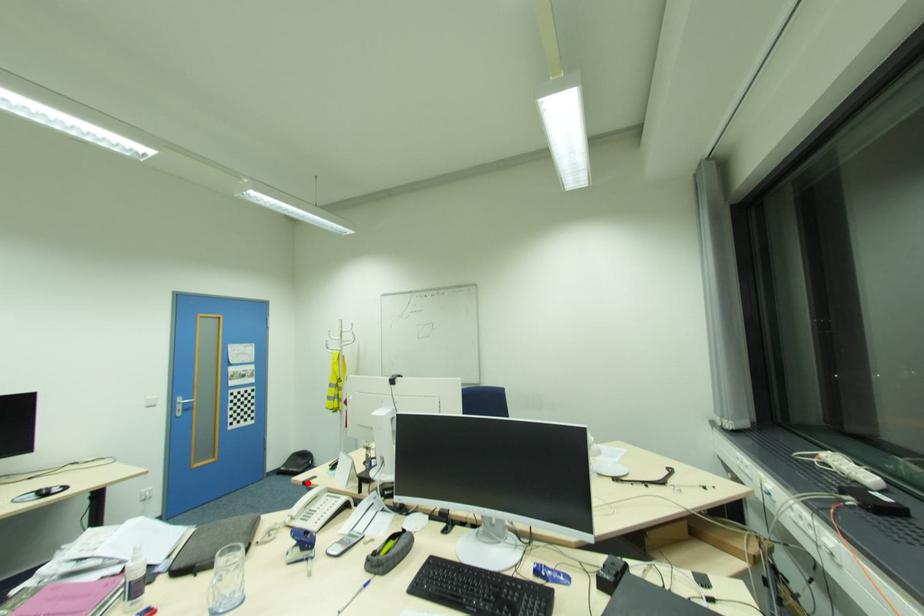
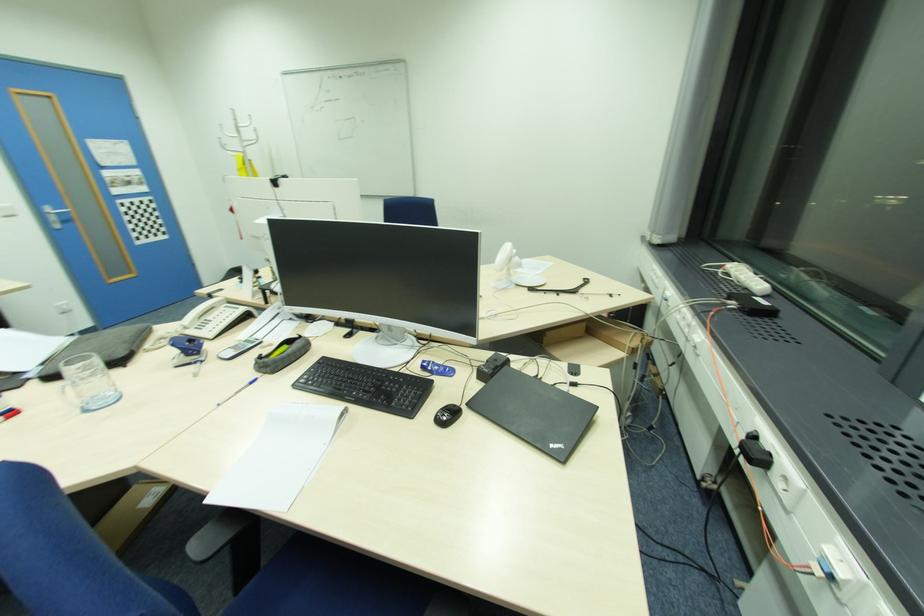
Locate, in the second image, the point that corresponds to the highlighted location in the first image.

(213, 294)